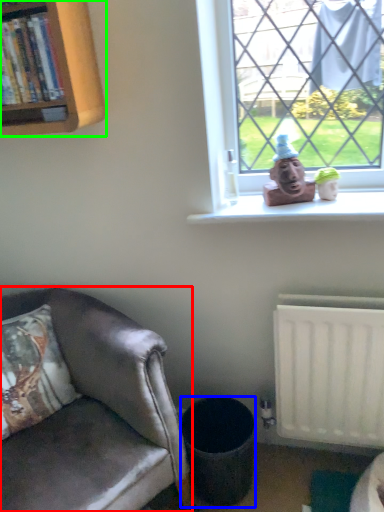
Question: Based on their relative distances, which object is farther from chair (highlighted by a red box)? Choose from trash bin/can (highlighted by a blue box) and bookcase (highlighted by a green box).

Choices:
 (A) trash bin/can
 (B) bookcase

Answer: (B)